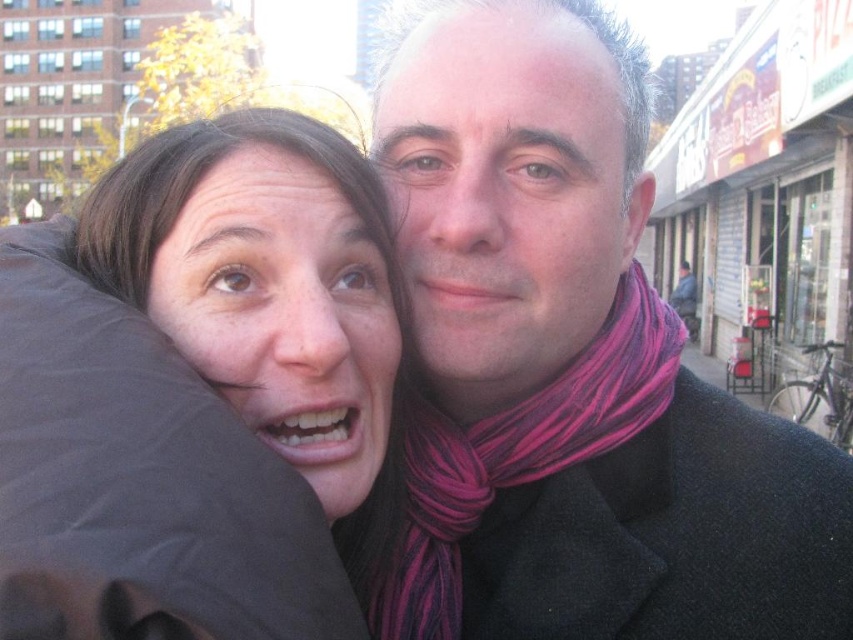
Question: Can you confirm if dark wool scarf at center is bigger than pink striped scarf at right?

Choices:
 (A) yes
 (B) no

Answer: (A)

Question: Which point is closer to the camera taking this photo?

Choices:
 (A) (780, 476)
 (B) (242, 323)

Answer: (A)

Question: Can you confirm if dark wool scarf at center is positioned to the left of pink striped scarf at right?

Choices:
 (A) no
 (B) yes

Answer: (A)

Question: Which point is closer to the camera?

Choices:
 (A) (270, 346)
 (B) (485, 419)
 (C) (653, 412)

Answer: (A)

Question: Does matte black jacket at left appear under pink striped scarf at right?

Choices:
 (A) yes
 (B) no

Answer: (B)

Question: Which object is farther from the camera taking this photo?

Choices:
 (A) matte black jacket at left
 (B) dark wool scarf at center

Answer: (A)